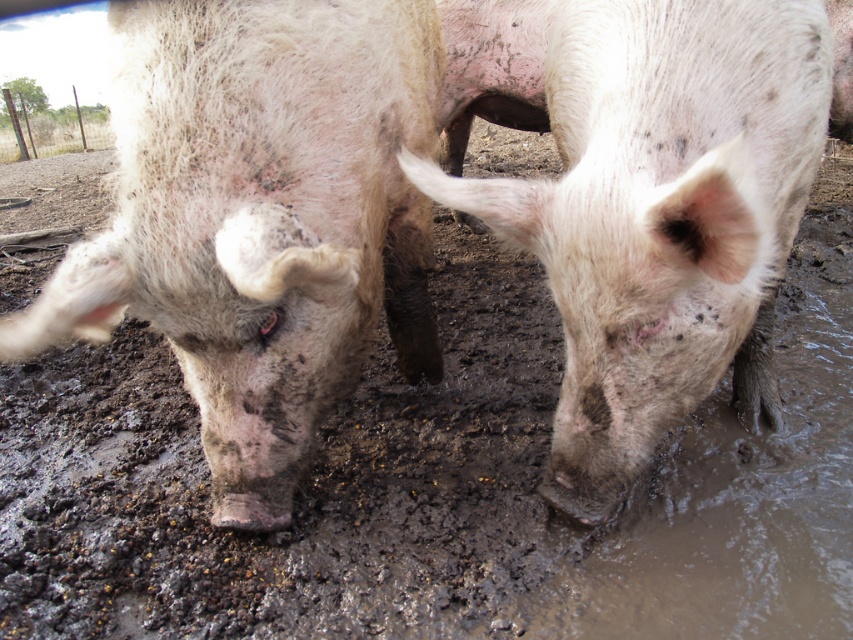
Question: Which object is farther from the camera taking this photo?

Choices:
 (A) dirty pink skin at center
 (B) speckled muddy pig at center

Answer: (A)

Question: Is dirty pink skin at center positioned before speckled muddy pig at center?

Choices:
 (A) yes
 (B) no

Answer: (B)

Question: Can you confirm if dirty pink skin at center is positioned to the left of speckled muddy pig at center?

Choices:
 (A) no
 (B) yes

Answer: (B)

Question: Can you confirm if dirty pink skin at center is positioned above speckled muddy pig at center?

Choices:
 (A) yes
 (B) no

Answer: (A)

Question: Which object appears farthest from the camera in this image?

Choices:
 (A) dirty pink skin at center
 (B) speckled muddy pig at center

Answer: (A)